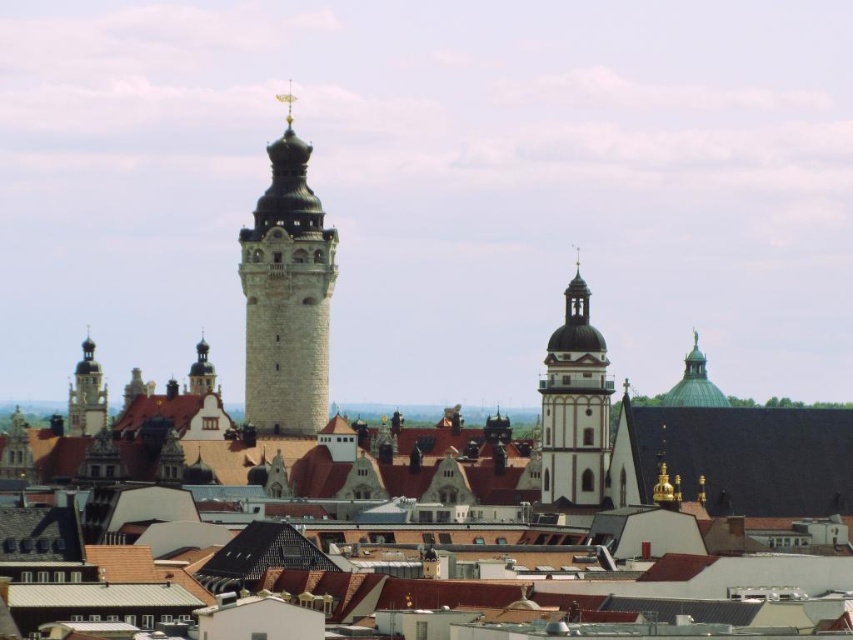
In the scene shown: Who is more distant from viewer, (305, 353) or (553, 397)?

The point (305, 353) is more distant.

Is white stone tower at center thinner than smooth white tower at center?

No.

What do you see at coordinates (286, 296) in the screenshot?
I see `white stone tower at center` at bounding box center [286, 296].

Where is `white stone tower at center`? Image resolution: width=853 pixels, height=640 pixels. white stone tower at center is located at coordinates (286, 296).

In the scene shown: Who is lower down, green tile roof at center or matte brown tower at center-left?

matte brown tower at center-left is below.

Between point (730, 426) and point (83, 344), which one is positioned behind?

Positioned behind is point (83, 344).

This screenshot has height=640, width=853. Find the location of `green tile roof at center`. green tile roof at center is located at coordinates (737, 458).

Which is below, white stone tower at center or matte brown tower at center-left?

matte brown tower at center-left is below.

Image resolution: width=853 pixels, height=640 pixels. Describe the element at coordinates (286, 296) in the screenshot. I see `white stone tower at center` at that location.

Locate an element on the screen. white stone tower at center is located at coordinates pyautogui.click(x=286, y=296).